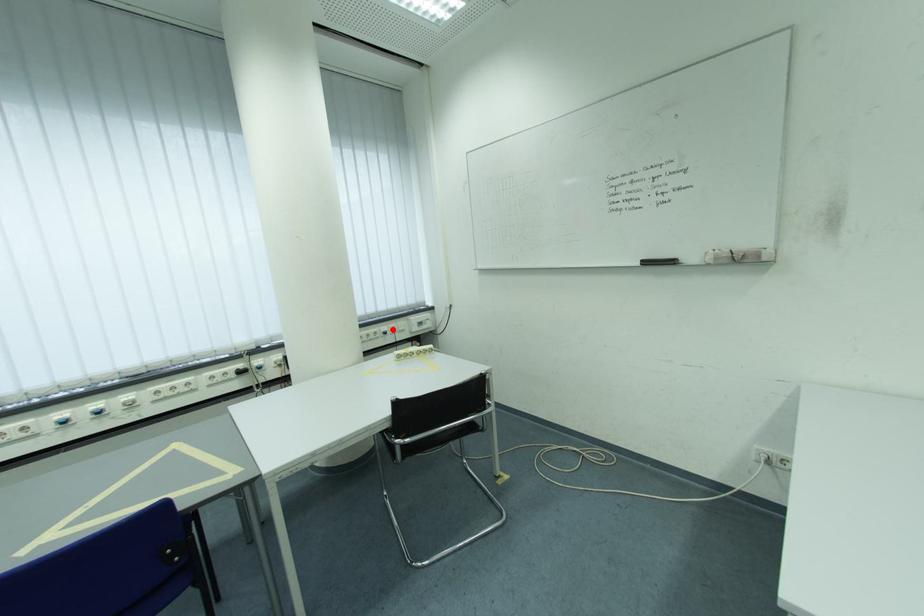
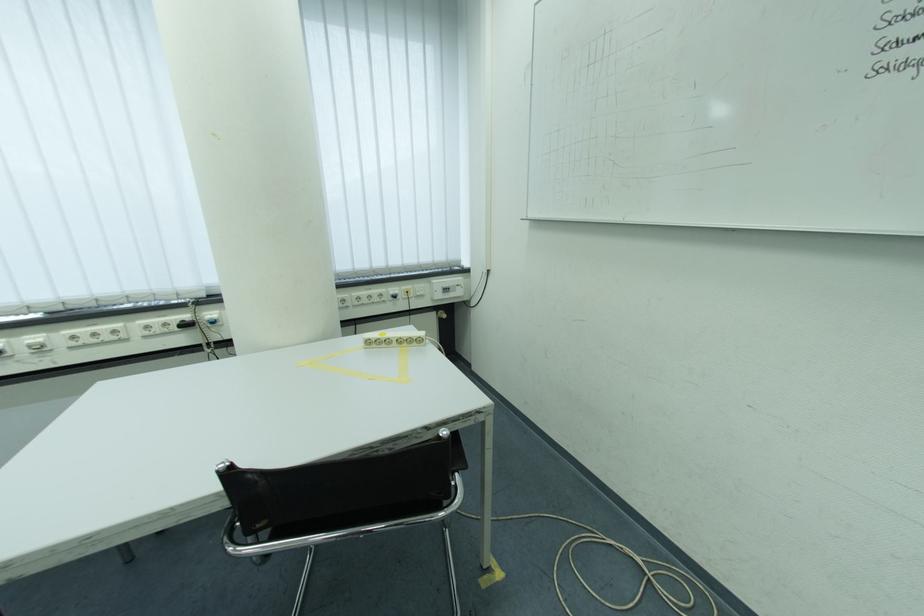
In the second image, find the point that corresponds to the highlighted location in the first image.

(402, 291)